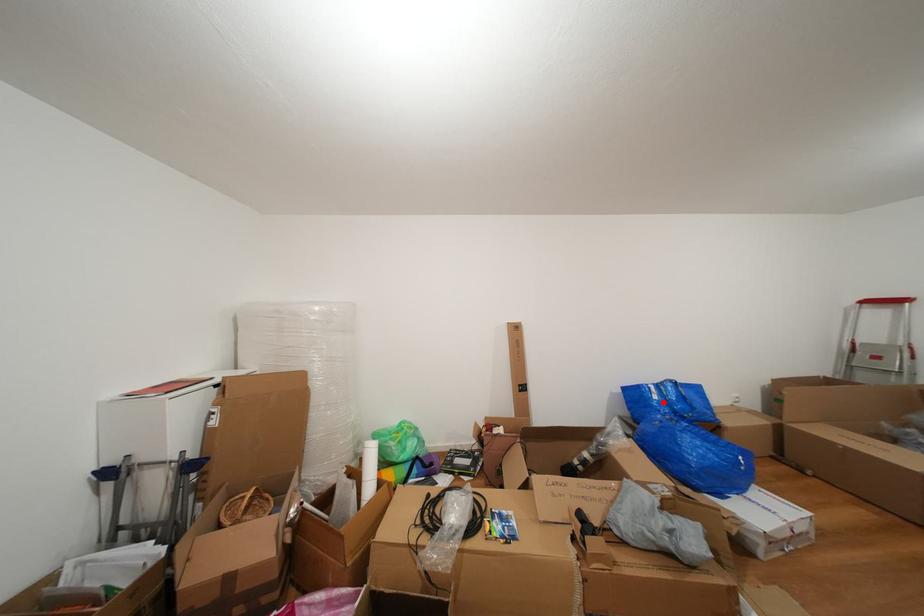
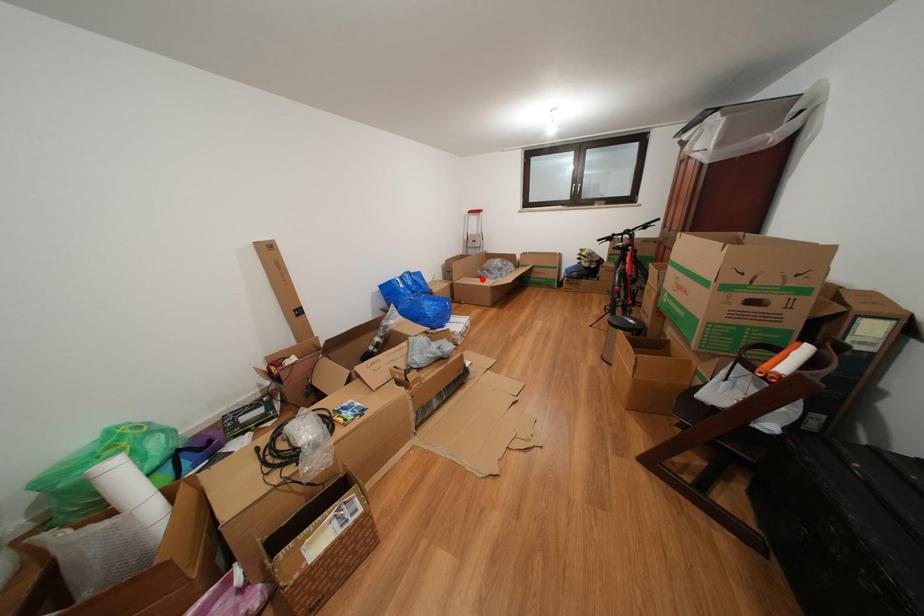
I am providing you with two images of the same scene from different viewpoints. A red point is marked on the first image and another point is marked on the second image. Do the highlighted points in image1 and image2 indicate the same real-world spot?

No